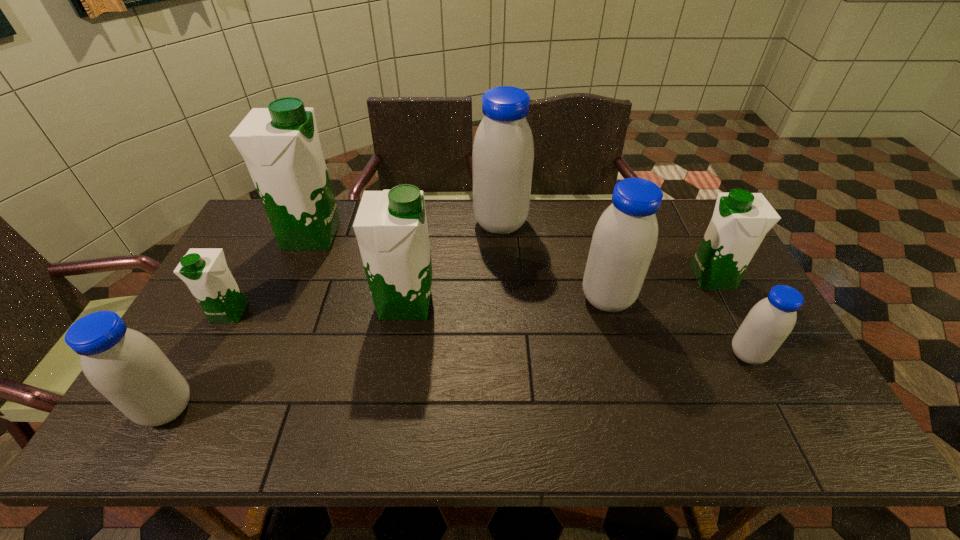
You are a GUI agent. You are given a task and a screenshot of the screen. Output one action in this format:
    pyautogui.click(x=<x>, y=<y>)
    Task: Click on the biggest green soya milk
    The width and height of the screenshot is (960, 540).
    Given the screenshot: What is the action you would take?
    pyautogui.click(x=280, y=145)

Locate an element on the screen. The height and width of the screenshot is (540, 960). the farthest blue soya milk is located at coordinates (503, 150).

I want to click on the fifth soya milk from left to right, so click(x=503, y=150).

Where is `the second green soya milk from right to left`? This screenshot has height=540, width=960. the second green soya milk from right to left is located at coordinates (391, 228).

Find the location of a particular element. the third smallest green soya milk is located at coordinates (391, 228).

Image resolution: width=960 pixels, height=540 pixels. What are the coordinates of `the third smallest blue soya milk` in the screenshot? It's located at (624, 240).

I want to click on the sixth object from left to right, so click(x=624, y=240).

This screenshot has height=540, width=960. What are the coordinates of `the third biggest green soya milk` in the screenshot? It's located at (741, 219).

I want to click on the second smallest blue soya milk, so click(125, 366).

This screenshot has height=540, width=960. What are the coordinates of `the nearest blue soya milk` in the screenshot? It's located at (125, 366).